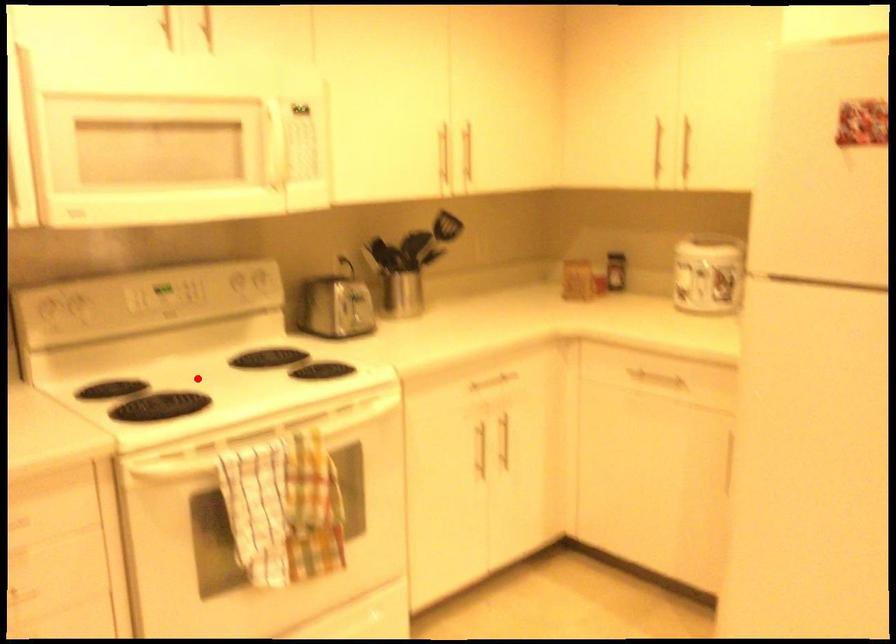
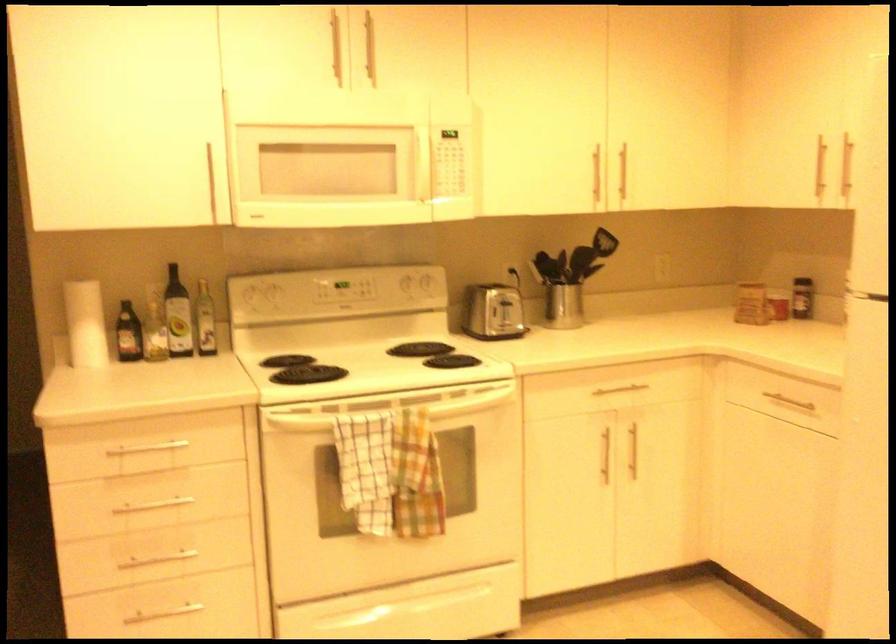
Question: I am providing you with two images of the same scene from different viewpoints. Image1 has a red point marked. In image2, the corresponding 3D location appears at what relative position? Reply with the corresponding letter.

Choices:
 (A) Closer
 (B) Farther

Answer: (B)